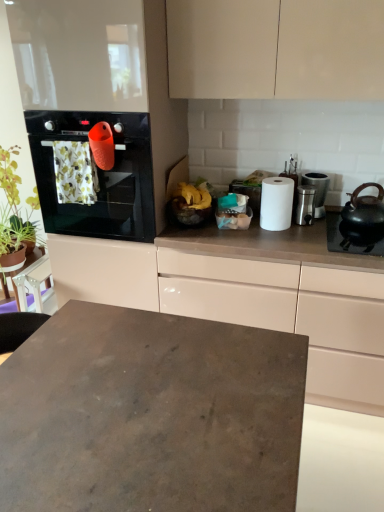
Question: Considering the relative sizes of black matte gas stove at right and green leafy plant at left in the image provided, is black matte gas stove at right bigger than green leafy plant at left?

Choices:
 (A) yes
 (B) no

Answer: (B)

Question: Can you confirm if black matte gas stove at right is shorter than green leafy plant at left?

Choices:
 (A) no
 (B) yes

Answer: (B)

Question: From a real-world perspective, is black matte gas stove at right positioned over green leafy plant at left based on gravity?

Choices:
 (A) no
 (B) yes

Answer: (B)

Question: From a real-world perspective, is black matte gas stove at right physically below green leafy plant at left?

Choices:
 (A) no
 (B) yes

Answer: (A)

Question: Is black matte gas stove at right outside green leafy plant at left?

Choices:
 (A) no
 (B) yes

Answer: (B)

Question: From the image's perspective, is black matte gas stove at right beneath green leafy plant at left?

Choices:
 (A) no
 (B) yes

Answer: (B)

Question: Does yellow matte bananas at center have a lesser width compared to satin silver canister at right, the 2th appliance when ordered from left to right?

Choices:
 (A) no
 (B) yes

Answer: (A)

Question: Is yellow matte bananas at center to the left of satin silver canister at right, which is the 1th appliance from right to left, from the viewer's perspective?

Choices:
 (A) no
 (B) yes

Answer: (B)

Question: Is yellow matte bananas at center outside of satin silver canister at right, which is the 1th appliance from right to left?

Choices:
 (A) no
 (B) yes

Answer: (B)

Question: Is yellow matte bananas at center positioned behind satin silver canister at right, which is the 1th appliance from right to left?

Choices:
 (A) yes
 (B) no

Answer: (B)

Question: Is yellow matte bananas at center shorter than satin silver canister at right, which is the 1th appliance from right to left?

Choices:
 (A) yes
 (B) no

Answer: (A)

Question: From a real-world perspective, is yellow matte bananas at center positioned over satin silver canister at right, which is the 1th appliance from right to left, based on gravity?

Choices:
 (A) yes
 (B) no

Answer: (A)

Question: Considering the relative sizes of green leafy plant at left and yellow matte bananas at center in the image provided, is green leafy plant at left wider than yellow matte bananas at center?

Choices:
 (A) yes
 (B) no

Answer: (B)